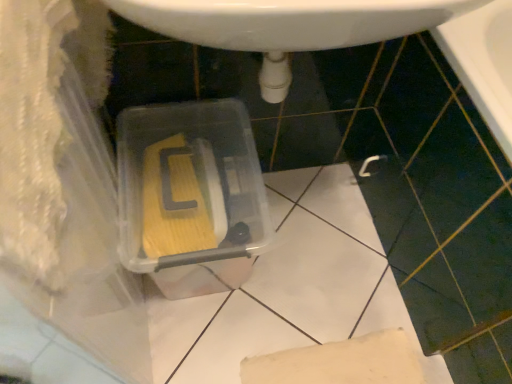
Question: Is white glossy sink at center next to transparent plastic storage box at center and touching it?

Choices:
 (A) no
 (B) yes

Answer: (A)

Question: Are white glossy sink at center and transparent plastic storage box at center located far from each other?

Choices:
 (A) no
 (B) yes

Answer: (A)

Question: Can you confirm if white glossy sink at center is bigger than transparent plastic storage box at center?

Choices:
 (A) no
 (B) yes

Answer: (A)

Question: Would you say white glossy sink at center contains transparent plastic storage box at center?

Choices:
 (A) yes
 (B) no

Answer: (B)

Question: Does white glossy sink at center come behind transparent plastic storage box at center?

Choices:
 (A) no
 (B) yes

Answer: (A)

Question: From a real-world perspective, is white glossy sink at center located higher than transparent plastic storage box at center?

Choices:
 (A) yes
 (B) no

Answer: (A)

Question: From the image's perspective, is transparent plastic storage box at center above white glossy sink at center?

Choices:
 (A) yes
 (B) no

Answer: (B)

Question: Considering the relative sizes of transparent plastic storage box at center and white glossy sink at center in the image provided, is transparent plastic storage box at center bigger than white glossy sink at center?

Choices:
 (A) no
 (B) yes

Answer: (B)

Question: Are transparent plastic storage box at center and white glossy sink at center making contact?

Choices:
 (A) no
 (B) yes

Answer: (A)

Question: Is transparent plastic storage box at center far away from white glossy sink at center?

Choices:
 (A) no
 (B) yes

Answer: (A)

Question: Is transparent plastic storage box at center looking in the opposite direction of white glossy sink at center?

Choices:
 (A) yes
 (B) no

Answer: (B)

Question: From the image's perspective, is transparent plastic storage box at center under white glossy sink at center?

Choices:
 (A) no
 (B) yes

Answer: (B)

Question: From the image's perspective, is white glossy sink at center located above or below transparent plastic storage box at center?

Choices:
 (A) above
 (B) below

Answer: (A)